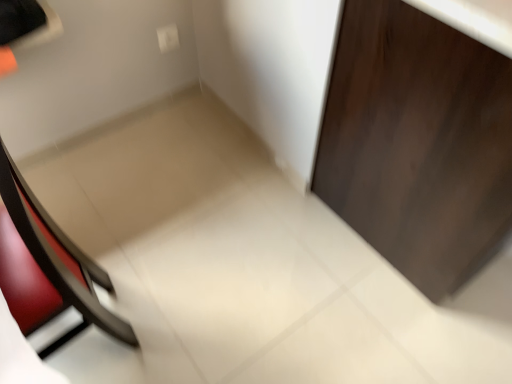
At what (x,y) coordinates should I click in order to perform the action: click on vacant region to the right of matte black chair at left. Please return your answer as a coordinate pair (x, y). The width and height of the screenshot is (512, 384). Looking at the image, I should click on (196, 309).